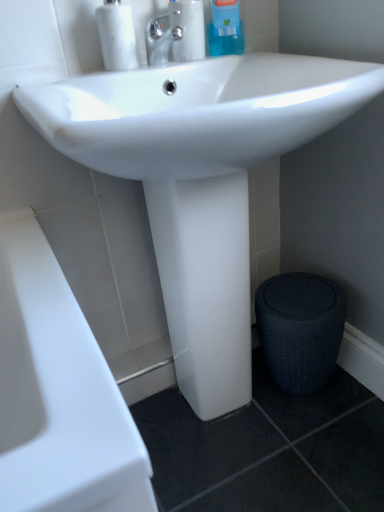
Question: From the image's perspective, does textured dark gray stool at lower right appear lower than polished chrome faucet at upper center?

Choices:
 (A) yes
 (B) no

Answer: (A)

Question: Considering the relative sizes of textured dark gray stool at lower right and polished chrome faucet at upper center in the image provided, is textured dark gray stool at lower right taller than polished chrome faucet at upper center?

Choices:
 (A) yes
 (B) no

Answer: (A)

Question: Is textured dark gray stool at lower right closer to camera compared to polished chrome faucet at upper center?

Choices:
 (A) yes
 (B) no

Answer: (B)

Question: Is textured dark gray stool at lower right further to the viewer compared to polished chrome faucet at upper center?

Choices:
 (A) no
 (B) yes

Answer: (B)

Question: Is textured dark gray stool at lower right bigger than polished chrome faucet at upper center?

Choices:
 (A) no
 (B) yes

Answer: (B)

Question: From the image's perspective, is clear plastic bottle at upper center, which is counted as the 2th cleaning product, starting from the right, above or below white marble soap dispenser at upper left?

Choices:
 (A) below
 (B) above

Answer: (B)

Question: Is clear plastic bottle at upper center, which is the 1th cleaning product from left to right, taller or shorter than white marble soap dispenser at upper left?

Choices:
 (A) short
 (B) tall

Answer: (A)

Question: Is clear plastic bottle at upper center, which is the 1th cleaning product from left to right, inside the boundaries of white marble soap dispenser at upper left, or outside?

Choices:
 (A) outside
 (B) inside

Answer: (A)

Question: Is clear plastic bottle at upper center, which is counted as the 2th cleaning product, starting from the right, wider or thinner than white marble soap dispenser at upper left?

Choices:
 (A) thin
 (B) wide

Answer: (B)

Question: From a real-world perspective, is textured dark gray stool at lower right above or below polished chrome faucet at upper center?

Choices:
 (A) below
 (B) above

Answer: (A)

Question: From the image's perspective, is textured dark gray stool at lower right positioned above or below polished chrome faucet at upper center?

Choices:
 (A) below
 (B) above

Answer: (A)

Question: Is textured dark gray stool at lower right wider or thinner than polished chrome faucet at upper center?

Choices:
 (A) wide
 (B) thin

Answer: (A)

Question: Considering the relative positions of textured dark gray stool at lower right and polished chrome faucet at upper center in the image provided, is textured dark gray stool at lower right to the left or to the right of polished chrome faucet at upper center?

Choices:
 (A) left
 (B) right

Answer: (B)

Question: Is textured dark gray stool at lower right in front of or behind clear plastic bottle at upper center, which is the 1th cleaning product from left to right, in the image?

Choices:
 (A) behind
 (B) front

Answer: (A)

Question: Is textured dark gray stool at lower right taller or shorter than clear plastic bottle at upper center, which is the 1th cleaning product from left to right?

Choices:
 (A) short
 (B) tall

Answer: (B)